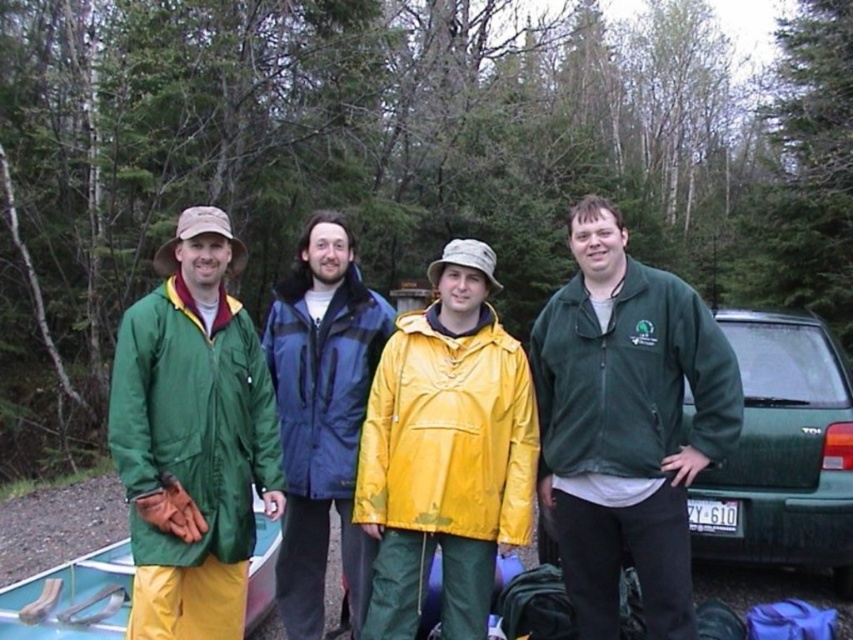
What do you see at coordinates (322, 416) in the screenshot?
I see `blue waterproof jacket at center` at bounding box center [322, 416].

In the scene shown: Is blue waterproof jacket at center below green matte van at right?

Actually, blue waterproof jacket at center is above green matte van at right.

Between point (317, 490) and point (810, 468), which one is positioned in front?

Positioned in front is point (317, 490).

At what (x,y) coordinates should I click in order to perform the action: click on blue waterproof jacket at center. Please return your answer as a coordinate pair (x, y). This screenshot has width=853, height=640. Looking at the image, I should click on (322, 416).

Is green fleece jacket at center further to camera compared to yellow waterproof jacket at center?

No, it is not.

Is green fleece jacket at center shorter than yellow waterproof jacket at center?

Incorrect, green fleece jacket at center's height does not fall short of yellow waterproof jacket at center's.

Does point (569, 397) come behind point (519, 518)?

No.

Locate an element on the screen. This screenshot has width=853, height=640. green fleece jacket at center is located at coordinates (625, 422).

Is point (256, 452) in front of point (689, 502)?

Yes, it is.

Which is more to the right, green matte raincoat at left or green matte van at right?

Positioned to the right is green matte van at right.

Describe the element at coordinates (192, 436) in the screenshot. I see `green matte raincoat at left` at that location.

Find the location of a particular element. The height and width of the screenshot is (640, 853). green matte raincoat at left is located at coordinates (192, 436).